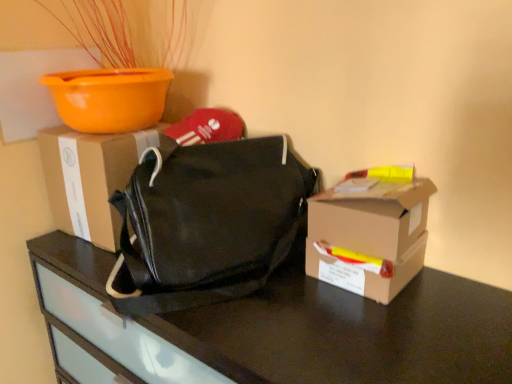
Find the location of `free location to the right of brown cardboard box at right, placed as the 2th box when sorted from back to front`. free location to the right of brown cardboard box at right, placed as the 2th box when sorted from back to front is located at coordinates (452, 303).